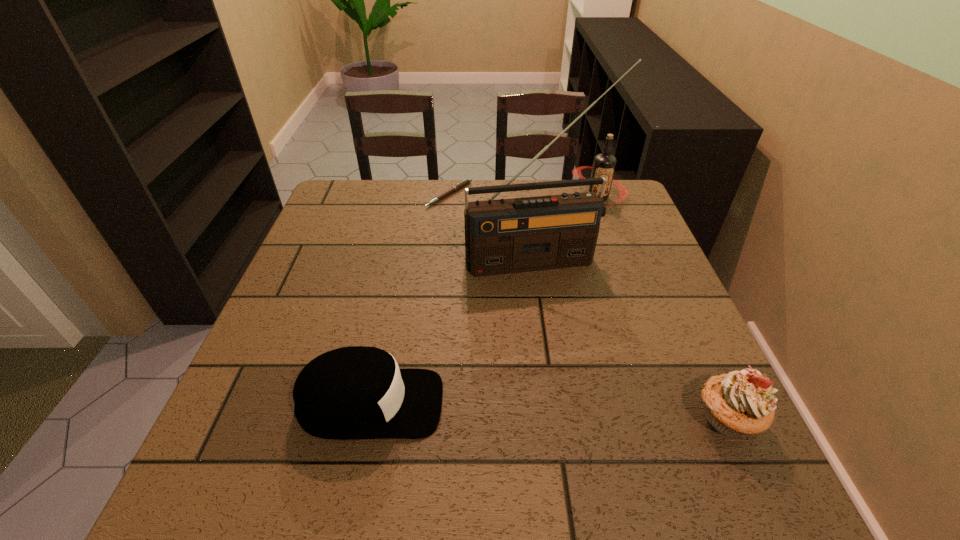
The height and width of the screenshot is (540, 960). I want to click on free space located on the front-facing side of the radio receiver, so click(x=565, y=320).

Identify the location of free space located 0.270m at the nib of the shortest object. (482, 266).

Where is `free region located at the nib of the shortest object`? The image size is (960, 540). free region located at the nib of the shortest object is located at coordinates (484, 268).

You are a GUI agent. You are given a task and a screenshot of the screen. Output one action in this format:
    pyautogui.click(x=<x>, y=<y>)
    Task: Click on the blank area located 0.260m at the nib of the shortest object
    The height and width of the screenshot is (540, 960).
    Given the screenshot: What is the action you would take?
    pyautogui.click(x=481, y=263)

Identify the location of free location located 0.200m on the label of the second tallest object. This screenshot has width=960, height=540. (580, 253).

I want to click on blank space located 0.390m on the label of the second tallest object, so click(x=565, y=302).

The height and width of the screenshot is (540, 960). I want to click on blank area located on the label of the second tallest object, so click(x=580, y=253).

Find the location of `pen that is positioned at the far edge`. pen that is positioned at the far edge is located at coordinates (458, 186).

The image size is (960, 540). I want to click on root beer that is at the far edge, so click(604, 164).

I want to click on cap at the near edge, so click(x=357, y=392).